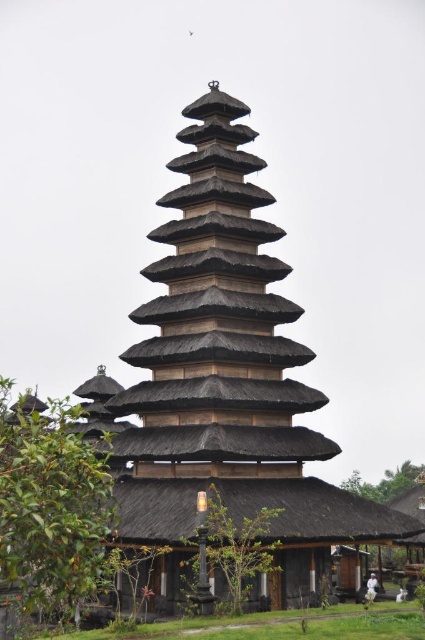
Can you confirm if green leafy tree at center is shorter than green leafy tree at lower right?

Indeed, green leafy tree at center has a lesser height compared to green leafy tree at lower right.

What do you see at coordinates (229, 548) in the screenshot?
I see `green leafy tree at center` at bounding box center [229, 548].

Which is in front, point (212, 545) or point (424, 477)?

Positioned in front is point (212, 545).

Where is `green leafy tree at center`? The height and width of the screenshot is (640, 425). green leafy tree at center is located at coordinates (229, 548).

Who is positioned more to the left, green leafy tree at lower left or green leafy tree at lower right?

green leafy tree at lower left

Is point (81, 451) positioned behind point (391, 497)?

That is False.

Measure the distance between point (33,564) and camera.

Result: They are 37.61 meters apart.

I want to click on green leafy tree at lower left, so pos(51,502).

Does green leafy tree at lower left have a larger size compared to green leafy tree at center?

Correct, green leafy tree at lower left is larger in size than green leafy tree at center.

This screenshot has height=640, width=425. What do you see at coordinates (51, 502) in the screenshot?
I see `green leafy tree at lower left` at bounding box center [51, 502].

You are a GUI agent. You are given a task and a screenshot of the screen. Output one action in this format:
    pyautogui.click(x=<x>, y=<y>)
    Task: Click on the green leafy tree at lower left
    This screenshot has width=425, height=640.
    Given the screenshot: What is the action you would take?
    pyautogui.click(x=51, y=502)